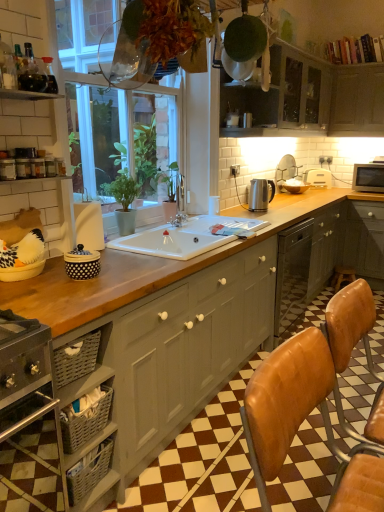
Question: Would you say matte black microwave at upper right, marked as the seventh appliance in a left-to-right arrangement, is part of metallic silver kettle at upper center, which is the sixth appliance from right to left,'s contents?

Choices:
 (A) no
 (B) yes

Answer: (A)

Question: From the image's perspective, is metallic silver kettle at upper center, which is the sixth appliance from right to left, located beneath matte black microwave at upper right, marked as the first appliance in a right-to-left arrangement?

Choices:
 (A) yes
 (B) no

Answer: (B)

Question: Does metallic silver kettle at upper center, which ranks as the 2th appliance in front-to-back order, have a larger size compared to matte black microwave at upper right, marked as the first appliance in a right-to-left arrangement?

Choices:
 (A) no
 (B) yes

Answer: (A)

Question: Is metallic silver kettle at upper center, which is the 6th appliance in back-to-front order, shorter than matte black microwave at upper right, marked as the first appliance in a right-to-left arrangement?

Choices:
 (A) yes
 (B) no

Answer: (A)

Question: Does metallic silver kettle at upper center, which ranks as the 2th appliance in front-to-back order, have a smaller size compared to matte black microwave at upper right, marked as the 2th appliance in a back-to-front arrangement?

Choices:
 (A) no
 (B) yes

Answer: (B)

Question: From the image's perspective, is satin nickel toaster at upper right, which is the 4th appliance from front to back, positioned above or below brown leather bar stool at lower right?

Choices:
 (A) below
 (B) above

Answer: (B)

Question: In terms of width, does satin nickel toaster at upper right, acting as the 4th appliance starting from the back, look wider or thinner when compared to brown leather bar stool at lower right?

Choices:
 (A) thin
 (B) wide

Answer: (A)

Question: Would you say satin nickel toaster at upper right, acting as the 4th appliance starting from the back, is inside or outside brown leather bar stool at lower right?

Choices:
 (A) inside
 (B) outside

Answer: (B)

Question: Is satin nickel toaster at upper right, acting as the 4th appliance starting from the back, in front of or behind brown leather bar stool at lower right in the image?

Choices:
 (A) front
 (B) behind

Answer: (B)

Question: Is satin nickel toaster at upper right, marked as the fourth appliance in a left-to-right arrangement, situated inside white ceramic sink at center or outside?

Choices:
 (A) outside
 (B) inside

Answer: (A)

Question: Considering the positions of point (276, 181) and point (205, 229), is point (276, 181) closer or farther from the camera than point (205, 229)?

Choices:
 (A) farther
 (B) closer

Answer: (A)

Question: Considering the positions of satin nickel toaster at upper right, which is the 4th appliance from front to back, and white ceramic sink at center in the image, is satin nickel toaster at upper right, which is the 4th appliance from front to back, taller or shorter than white ceramic sink at center?

Choices:
 (A) short
 (B) tall

Answer: (B)

Question: Is satin nickel toaster at upper right, marked as the fourth appliance in a left-to-right arrangement, to the left or to the right of white ceramic sink at center in the image?

Choices:
 (A) left
 (B) right

Answer: (B)

Question: Considering the positions of matte gray cabinet at center, positioned as the first cabinetry in bottom-to-top order, and matte gray cabinets at upper center, the second cabinetry viewed from the right, in the image, is matte gray cabinet at center, positioned as the first cabinetry in bottom-to-top order, bigger or smaller than matte gray cabinets at upper center, the second cabinetry viewed from the right,?

Choices:
 (A) small
 (B) big

Answer: (B)

Question: Is matte gray cabinet at center, the 3th cabinetry when ordered from top to bottom, spatially inside matte gray cabinets at upper center, the second cabinetry positioned from the top, or outside of it?

Choices:
 (A) outside
 (B) inside

Answer: (A)